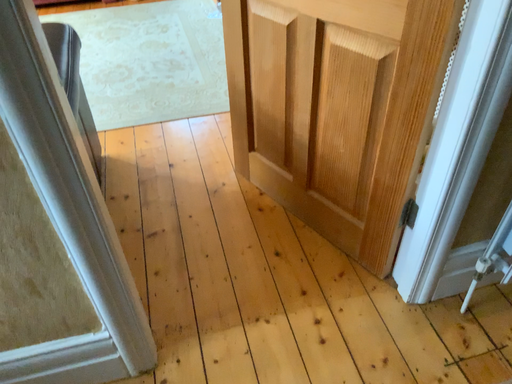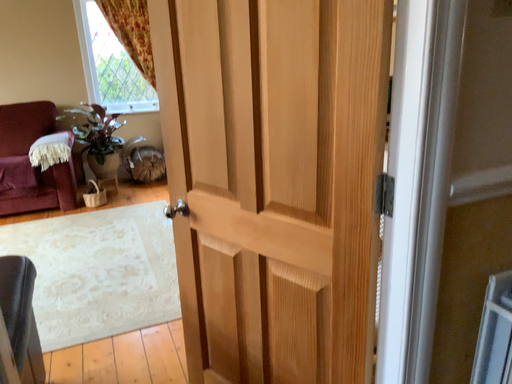
Question: How did the camera likely rotate when shooting the video?

Choices:
 (A) rotated upward
 (B) rotated downward

Answer: (A)